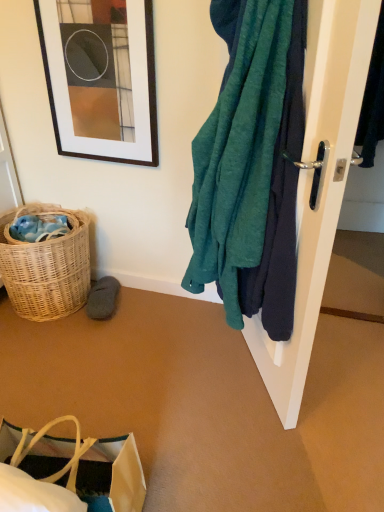
Question: Is woven wicker basket at lower left in front of or behind white glossy door handle at right in the image?

Choices:
 (A) behind
 (B) front

Answer: (A)

Question: Is woven wicker basket at lower left inside or outside of white glossy door handle at right?

Choices:
 (A) outside
 (B) inside

Answer: (A)

Question: Considering the real-world distances, which object is closest to the gray suede slipper at lower left?

Choices:
 (A) white glossy door handle at right
 (B) matte black picture frame at upper left
 (C) woven wicker basket at lower left
 (D) brown paper bag at lower left
 (E) teal fabric towel at right

Answer: (C)

Question: Considering the real-world distances, which object is closest to the brown paper bag at lower left?

Choices:
 (A) teal fabric towel at right
 (B) gray suede slipper at lower left
 (C) white glossy door handle at right
 (D) woven wicker basket at lower left
 (E) matte black picture frame at upper left

Answer: (A)